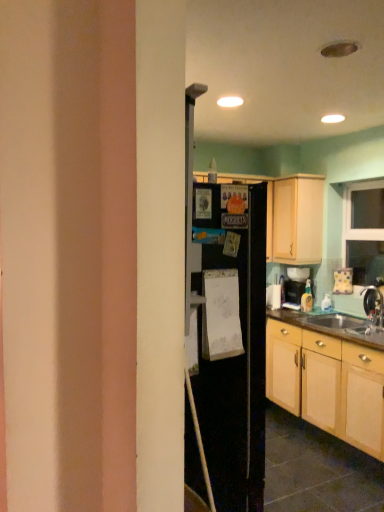
What do you see at coordinates (297, 220) in the screenshot?
I see `light wood cabinet at upper right, which is counted as the second cabinetry, starting from the bottom` at bounding box center [297, 220].

This screenshot has width=384, height=512. What do you see at coordinates (332, 326) in the screenshot? I see `brown wood countertop at lower right` at bounding box center [332, 326].

Locate an element on the screen. The width and height of the screenshot is (384, 512). light wood cabinet at lower right, the second cabinetry when ordered from top to bottom is located at coordinates (327, 384).

At what (x,y) coordinates should I click in order to perform the action: click on metallic silver faucet at lower right. Please return your answer as a coordinate pair (x, y). This screenshot has width=384, height=512. Looking at the image, I should click on (374, 305).

Where is `light wood cabinet at upper right, which is counted as the second cabinetry, starting from the bottom`? light wood cabinet at upper right, which is counted as the second cabinetry, starting from the bottom is located at coordinates (297, 220).

Is metallic silver faucet at lower right turned away from light wood cabinet at lower right, the second cabinetry when ordered from top to bottom?

No, metallic silver faucet at lower right's orientation is not away from light wood cabinet at lower right, the second cabinetry when ordered from top to bottom.

From a real-world perspective, which object rests below the other?

From a 3D spatial view, light wood cabinet at lower right, the second cabinetry when ordered from top to bottom, is below.

Is point (383, 325) farther from camera compared to point (304, 389)?

No, (383, 325) is in front of (304, 389).

Is brown wood countertop at lower right at the right side of light wood cabinet at lower right, the 1th cabinetry in the bottom-to-top sequence?

Indeed, brown wood countertop at lower right is positioned on the right side of light wood cabinet at lower right, the 1th cabinetry in the bottom-to-top sequence.

Where is `cabinetry below the brown wood countertop at lower right (from the image's perspective)`? The height and width of the screenshot is (512, 384). cabinetry below the brown wood countertop at lower right (from the image's perspective) is located at coordinates (327, 384).

From the image's perspective, which one is positioned lower, brown wood countertop at lower right or light wood cabinet at lower right, the second cabinetry when ordered from top to bottom?

light wood cabinet at lower right, the second cabinetry when ordered from top to bottom, from the image's perspective.

Is brown wood countertop at lower right looking in the opposite direction of light wood cabinet at lower right, the second cabinetry when ordered from top to bottom?

That's right, brown wood countertop at lower right is facing away from light wood cabinet at lower right, the second cabinetry when ordered from top to bottom.

Considering the sizes of objects light wood cabinet at lower right, the 1th cabinetry in the bottom-to-top sequence, and brown wood countertop at lower right in the image provided, who is wider, light wood cabinet at lower right, the 1th cabinetry in the bottom-to-top sequence, or brown wood countertop at lower right?

light wood cabinet at lower right, the 1th cabinetry in the bottom-to-top sequence, is wider.

Is light wood cabinet at lower right, the 1th cabinetry in the bottom-to-top sequence, behind brown wood countertop at lower right?

No, it is in front of brown wood countertop at lower right.

From the image's perspective, is light wood cabinet at lower right, the second cabinetry when ordered from top to bottom, below brown wood countertop at lower right?

Correct, light wood cabinet at lower right, the second cabinetry when ordered from top to bottom, appears lower than brown wood countertop at lower right in the image.

From a real-world perspective, is light wood cabinet at lower right, the second cabinetry when ordered from top to bottom, on top of brown wood countertop at lower right?

Incorrect, from a real-world perspective, light wood cabinet at lower right, the second cabinetry when ordered from top to bottom, is lower than brown wood countertop at lower right.

From a real-world perspective, between light wood cabinet at upper right, which is counted as the second cabinetry, starting from the bottom, and light wood cabinet at lower right, the 1th cabinetry in the bottom-to-top sequence, who is vertically higher?

light wood cabinet at upper right, which is counted as the second cabinetry, starting from the bottom.

Is light wood cabinet at upper right, which is counted as the second cabinetry, starting from the bottom, next to light wood cabinet at lower right, the second cabinetry when ordered from top to bottom?

light wood cabinet at upper right, which is counted as the second cabinetry, starting from the bottom, is not next to light wood cabinet at lower right, the second cabinetry when ordered from top to bottom, and they're not touching.

In the image, there is a light wood cabinet at lower right, the second cabinetry when ordered from top to bottom. In order to click on cabinetry above it (from the image's perspective) in this screenshot , I will do `click(297, 220)`.

Is light wood cabinet at upper right, which is counted as the second cabinetry, starting from the bottom, smaller than metallic silver faucet at lower right?

Incorrect, light wood cabinet at upper right, which is counted as the second cabinetry, starting from the bottom, is not smaller in size than metallic silver faucet at lower right.

Is light wood cabinet at upper right, which is counted as the second cabinetry, starting from the bottom, situated inside metallic silver faucet at lower right or outside?

light wood cabinet at upper right, which is counted as the second cabinetry, starting from the bottom, lies outside metallic silver faucet at lower right.

Is light wood cabinet at upper right, which is the 1th cabinetry in top-to-bottom order, not near metallic silver faucet at lower right?

No.

Which object is further away from the camera taking this photo, light wood cabinet at upper right, which is the 1th cabinetry in top-to-bottom order, or metallic silver faucet at lower right?

light wood cabinet at upper right, which is the 1th cabinetry in top-to-bottom order, is behind.

Is brown wood countertop at lower right thinner than metallic silver faucet at lower right?

Incorrect, the width of brown wood countertop at lower right is not less than that of metallic silver faucet at lower right.

Is brown wood countertop at lower right located outside metallic silver faucet at lower right?

That's correct, brown wood countertop at lower right is outside of metallic silver faucet at lower right.

Is brown wood countertop at lower right closer to the viewer compared to metallic silver faucet at lower right?

Yes, the depth of brown wood countertop at lower right is less than that of metallic silver faucet at lower right.

From the image's perspective, would you say brown wood countertop at lower right is shown under metallic silver faucet at lower right?

Yes, from the image's perspective, brown wood countertop at lower right is below metallic silver faucet at lower right.

The height and width of the screenshot is (512, 384). I want to click on countertop that appears below the light wood cabinet at upper right, which is the 1th cabinetry in top-to-bottom order (from the image's perspective), so click(x=332, y=326).

Is light wood cabinet at upper right, which is counted as the second cabinetry, starting from the bottom, oriented away from brown wood countertop at lower right?

No, brown wood countertop at lower right is not at the back of light wood cabinet at upper right, which is counted as the second cabinetry, starting from the bottom.

Is light wood cabinet at upper right, which is the 1th cabinetry in top-to-bottom order, positioned in front of brown wood countertop at lower right?

No, it is behind brown wood countertop at lower right.

Between light wood cabinet at upper right, which is counted as the second cabinetry, starting from the bottom, and brown wood countertop at lower right, which one has more height?

light wood cabinet at upper right, which is counted as the second cabinetry, starting from the bottom, is taller.

Locate an element on the screen. The height and width of the screenshot is (512, 384). tap above the light wood cabinet at lower right, the second cabinetry when ordered from top to bottom (from a real-world perspective) is located at coordinates (374, 305).

Locate an element on the screen. This screenshot has width=384, height=512. countertop to the right of light wood cabinet at lower right, the second cabinetry when ordered from top to bottom is located at coordinates (332, 326).

Based on their spatial positions, is light wood cabinet at lower right, the second cabinetry when ordered from top to bottom, or metallic silver faucet at lower right closer to brown wood countertop at lower right?

light wood cabinet at lower right, the second cabinetry when ordered from top to bottom, is positioned closer to the anchor brown wood countertop at lower right.

Considering their positions, is light wood cabinet at lower right, the second cabinetry when ordered from top to bottom, positioned further to metallic silver faucet at lower right than light wood cabinet at upper right, which is counted as the second cabinetry, starting from the bottom?

light wood cabinet at upper right, which is counted as the second cabinetry, starting from the bottom, is further to metallic silver faucet at lower right.

Considering their positions, is brown wood countertop at lower right positioned further to metallic silver faucet at lower right than light wood cabinet at lower right, the second cabinetry when ordered from top to bottom?

light wood cabinet at lower right, the second cabinetry when ordered from top to bottom, lies further to metallic silver faucet at lower right than the other object.

Which object lies nearer to the anchor point light wood cabinet at lower right, the 1th cabinetry in the bottom-to-top sequence, metallic silver faucet at lower right or brown wood countertop at lower right?

Among the two, brown wood countertop at lower right is located nearer to light wood cabinet at lower right, the 1th cabinetry in the bottom-to-top sequence.

Looking at the image, which one is located further to light wood cabinet at lower right, the second cabinetry when ordered from top to bottom, brown wood countertop at lower right or metallic silver faucet at lower right?

metallic silver faucet at lower right is further to light wood cabinet at lower right, the second cabinetry when ordered from top to bottom.

Estimate the real-world distances between objects in this image. Which object is closer to light wood cabinet at upper right, which is counted as the second cabinetry, starting from the bottom, light wood cabinet at lower right, the second cabinetry when ordered from top to bottom, or brown wood countertop at lower right?

brown wood countertop at lower right is closer to light wood cabinet at upper right, which is counted as the second cabinetry, starting from the bottom.

Estimate the real-world distances between objects in this image. Which object is closer to metallic silver faucet at lower right, light wood cabinet at lower right, the second cabinetry when ordered from top to bottom, or brown wood countertop at lower right?

brown wood countertop at lower right is closer to metallic silver faucet at lower right.

When comparing their distances from brown wood countertop at lower right, does metallic silver faucet at lower right or light wood cabinet at upper right, which is the 1th cabinetry in top-to-bottom order, seem further?

Based on the image, light wood cabinet at upper right, which is the 1th cabinetry in top-to-bottom order, appears to be further to brown wood countertop at lower right.

Locate an element on the screen. This screenshot has height=512, width=384. countertop positioned between light wood cabinet at lower right, the 1th cabinetry in the bottom-to-top sequence, and metallic silver faucet at lower right from near to far is located at coordinates (332, 326).

Find the location of a particular element. The image size is (384, 512). countertop between light wood cabinet at upper right, which is the 1th cabinetry in top-to-bottom order, and light wood cabinet at lower right, the 1th cabinetry in the bottom-to-top sequence, in the vertical direction is located at coordinates (332, 326).

This screenshot has width=384, height=512. Find the location of `tap between light wood cabinet at upper right, which is counted as the second cabinetry, starting from the bottom, and brown wood countertop at lower right, in the vertical direction`. tap between light wood cabinet at upper right, which is counted as the second cabinetry, starting from the bottom, and brown wood countertop at lower right, in the vertical direction is located at coordinates (374, 305).

This screenshot has height=512, width=384. What are the coordinates of `tap between light wood cabinet at upper right, which is counted as the second cabinetry, starting from the bottom, and light wood cabinet at lower right, the 1th cabinetry in the bottom-to-top sequence, vertically` in the screenshot? It's located at (374, 305).